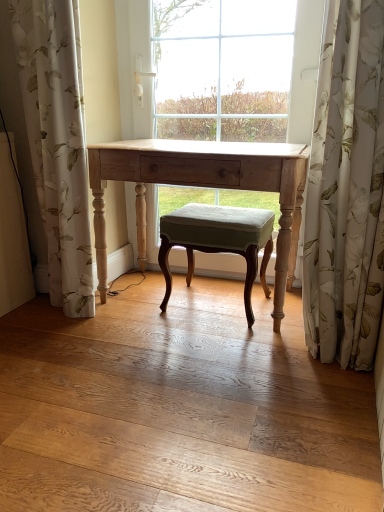
Identify the location of free space above velvet green stool at center (from a real-world perspective). This screenshot has height=512, width=384. (231, 206).